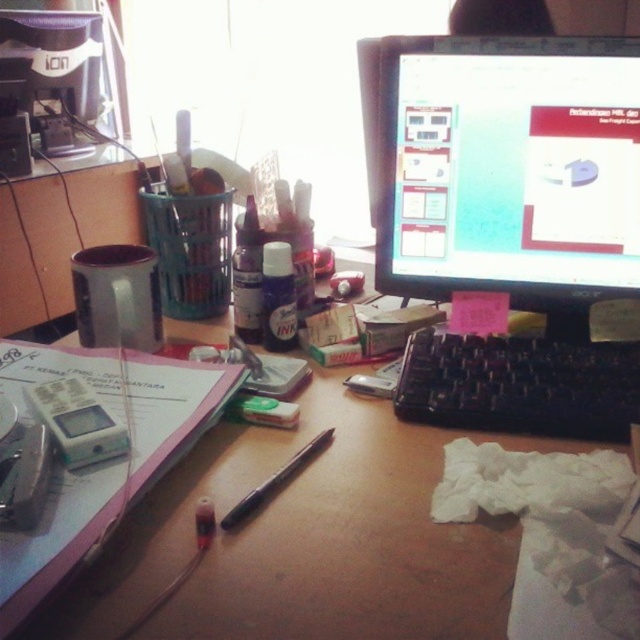
Does pink paper notebook at lower left have a smaller size compared to white plastic calculator at left?

No.

Between pink paper notebook at lower left and white plastic calculator at left, which one has more height?

pink paper notebook at lower left

Is point (52, 516) behind point (61, 397)?

No, it is not.

Identify the location of pink paper notebook at lower left. The image size is (640, 640). (104, 461).

Find the location of a particular element. The height and width of the screenshot is (640, 640). black plastic monitor at center is located at coordinates click(x=512, y=220).

Is black plastic monitor at center thinner than white plastic calculator at left?

No.

What do you see at coordinates (512, 220) in the screenshot?
I see `black plastic monitor at center` at bounding box center [512, 220].

This screenshot has height=640, width=640. I want to click on black plastic monitor at center, so click(512, 220).

Who is taller, black plastic keyboard at center or matte black pen at center?

black plastic keyboard at center is taller.

Measure the distance between black plastic keyboard at center and camera.

A distance of 22.97 inches exists between black plastic keyboard at center and camera.

Locate an element on the screen. The image size is (640, 640). black plastic keyboard at center is located at coordinates (518, 385).